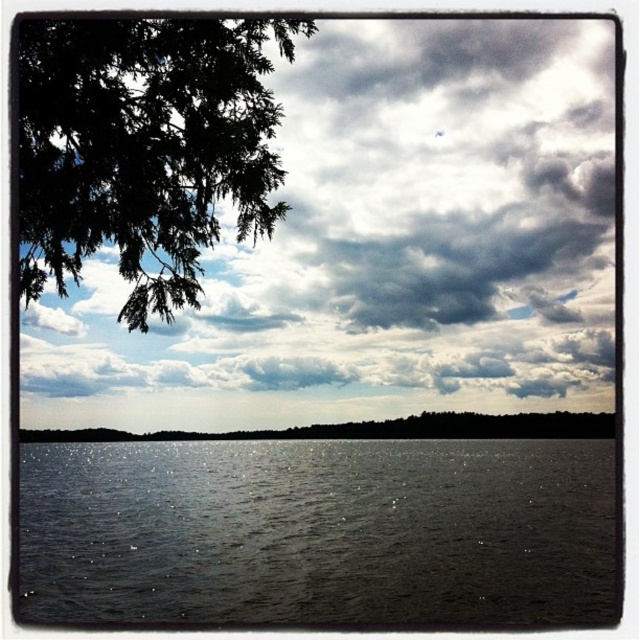
Can you confirm if cloudy sky at upper center is positioned to the right of glistening dark water at center?

Indeed, cloudy sky at upper center is positioned on the right side of glistening dark water at center.

Does cloudy sky at upper center have a lesser width compared to glistening dark water at center?

In fact, cloudy sky at upper center might be wider than glistening dark water at center.

Who is more forward, (497, 260) or (100, 584)?

Positioned in front is point (100, 584).

Find the location of a particular element. The width and height of the screenshot is (640, 640). cloudy sky at upper center is located at coordinates (394, 230).

Does point (150, 490) come closer to viewer compared to point (556, 422)?

Yes, it is.

Between point (564, 467) and point (561, 422), which one is positioned behind?

Point (561, 422)

Image resolution: width=640 pixels, height=640 pixels. What do you see at coordinates (317, 531) in the screenshot?
I see `glistening dark water at center` at bounding box center [317, 531].

The image size is (640, 640). I want to click on glistening dark water at center, so click(317, 531).

Which is more to the left, glistening dark water at center or green leafy branch at upper left?

From the viewer's perspective, green leafy branch at upper left appears more on the left side.

Between glistening dark water at center and green leafy branch at upper left, which one is positioned lower?

glistening dark water at center

The height and width of the screenshot is (640, 640). Find the location of `glistening dark water at center`. glistening dark water at center is located at coordinates (317, 531).